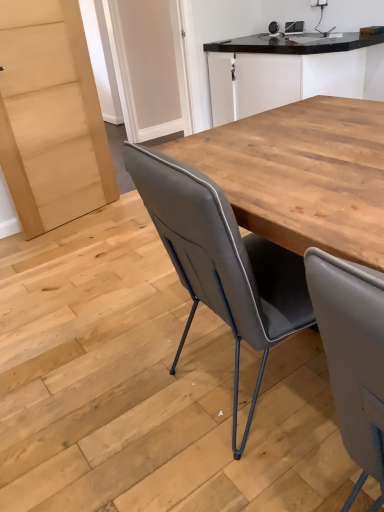
The image size is (384, 512). What do you see at coordinates (221, 261) in the screenshot?
I see `matte gray leather chair at center` at bounding box center [221, 261].

Where is `matte gray leather chair at center`? Image resolution: width=384 pixels, height=512 pixels. matte gray leather chair at center is located at coordinates (221, 261).

Locate an element on the screen. The image size is (384, 512). black granite countertop at upper center is located at coordinates (283, 70).

The height and width of the screenshot is (512, 384). Describe the element at coordinates (283, 70) in the screenshot. I see `black granite countertop at upper center` at that location.

Find the location of a particular element. Image resolution: width=384 pixels, height=512 pixels. matte gray leather chair at center is located at coordinates (221, 261).

Is matte gray leather chair at center at the right side of black granite countertop at upper center?

In fact, matte gray leather chair at center is to the left of black granite countertop at upper center.

Based on the photo, relative to black granite countertop at upper center, is matte gray leather chair at center in front or behind?

Clearly, matte gray leather chair at center is in front of black granite countertop at upper center.

Which point is more distant from viewer, (257, 239) or (370, 40)?

Point (370, 40)

Based on the photo, from the image's perspective, is matte gray leather chair at center located above black granite countertop at upper center?

No, from the image's perspective, matte gray leather chair at center is not above black granite countertop at upper center.

From a real-world perspective, is matte gray leather chair at center located beneath black granite countertop at upper center?

Yes, from a real-world perspective, matte gray leather chair at center is under black granite countertop at upper center.

Considering the sizes of objects matte gray leather chair at center and black granite countertop at upper center in the image provided, who is wider, matte gray leather chair at center or black granite countertop at upper center?

With larger width is matte gray leather chair at center.

Considering the sizes of matte gray leather chair at center and black granite countertop at upper center in the image, is matte gray leather chair at center taller or shorter than black granite countertop at upper center?

In the image, matte gray leather chair at center appears to be taller than black granite countertop at upper center.

Can you confirm if matte gray leather chair at center is bigger than black granite countertop at upper center?

Actually, matte gray leather chair at center might be smaller than black granite countertop at upper center.

Is matte gray leather chair at center surrounding black granite countertop at upper center?

No, black granite countertop at upper center is located outside of matte gray leather chair at center.

Are matte gray leather chair at center and black granite countertop at upper center located far from each other?

Yes, matte gray leather chair at center is far from black granite countertop at upper center.

Does matte gray leather chair at center turn towards black granite countertop at upper center?

No, matte gray leather chair at center is not aimed at black granite countertop at upper center.

How many degrees apart are the facing directions of matte gray leather chair at center and black granite countertop at upper center?

They differ by 177 degrees in their facing directions.

Where is `cabinetry on the right of matte gray leather chair at center`? Image resolution: width=384 pixels, height=512 pixels. cabinetry on the right of matte gray leather chair at center is located at coordinates tap(283, 70).

Based on their positions, is black granite countertop at upper center located to the left or right of matte gray leather chair at center?

Clearly, black granite countertop at upper center is on the right of matte gray leather chair at center in the image.

Is black granite countertop at upper center closer to the viewer compared to matte gray leather chair at center?

No, the depth of black granite countertop at upper center is greater than that of matte gray leather chair at center.

Considering the points (322, 54) and (194, 293), which point is behind, point (322, 54) or point (194, 293)?

Positioned behind is point (322, 54).

From the image's perspective, does black granite countertop at upper center appear lower than matte gray leather chair at center?

No, from the image's perspective, black granite countertop at upper center is not beneath matte gray leather chair at center.

From a real-world perspective, which is physically above, black granite countertop at upper center or matte gray leather chair at center?

black granite countertop at upper center, from a real-world perspective.

Is black granite countertop at upper center thinner than matte gray leather chair at center?

Correct, the width of black granite countertop at upper center is less than that of matte gray leather chair at center.

Between black granite countertop at upper center and matte gray leather chair at center, which one has more height?

With more height is matte gray leather chair at center.

In the scene shown: Considering the relative sizes of black granite countertop at upper center and matte gray leather chair at center in the image provided, is black granite countertop at upper center smaller than matte gray leather chair at center?

Actually, black granite countertop at upper center might be larger than matte gray leather chair at center.

Is black granite countertop at upper center not within matte gray leather chair at center?

black granite countertop at upper center is positioned outside matte gray leather chair at center.

Are black granite countertop at upper center and matte gray leather chair at center far apart?

Yes, black granite countertop at upper center and matte gray leather chair at center are quite far apart.

Could you tell me if black granite countertop at upper center is facing matte gray leather chair at center?

No, black granite countertop at upper center is not facing towards matte gray leather chair at center.

How different are the orientations of black granite countertop at upper center and matte gray leather chair at center in degrees?

They differ by 177 degrees in their facing directions.

Locate an element on the screen. The image size is (384, 512). cabinetry above the matte gray leather chair at center (from the image's perspective) is located at coordinates (283, 70).

Where is `cabinetry lying behind the matte gray leather chair at center`? cabinetry lying behind the matte gray leather chair at center is located at coordinates (283, 70).

Where is `cabinetry that appears above the matte gray leather chair at center (from the image's perspective)`? This screenshot has width=384, height=512. cabinetry that appears above the matte gray leather chair at center (from the image's perspective) is located at coordinates (283, 70).